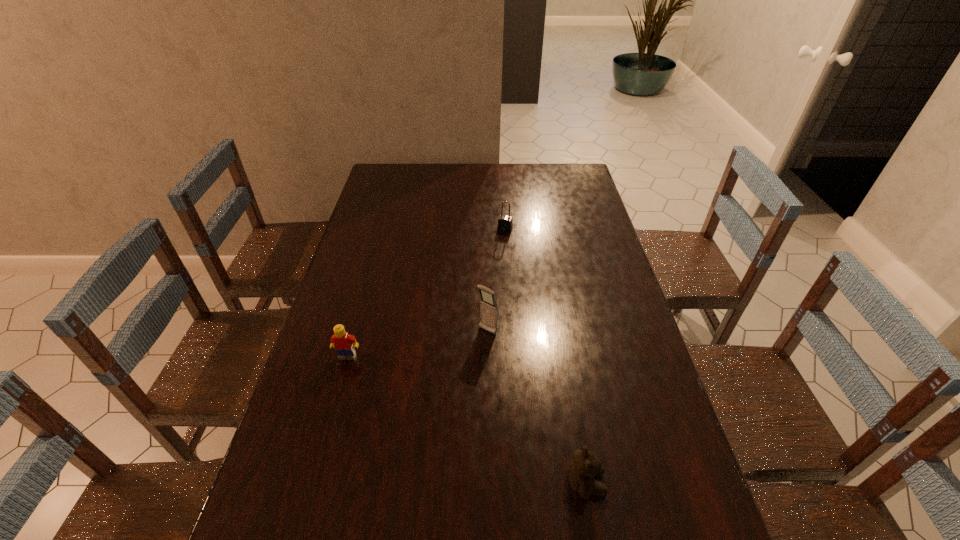
Where is `free space between the second nearest object and the farthest object`? Image resolution: width=960 pixels, height=540 pixels. free space between the second nearest object and the farthest object is located at coordinates (426, 292).

This screenshot has height=540, width=960. I want to click on free spot between the padlock and the Lego, so click(x=426, y=292).

Find the location of `empty space that is in between the cellular telephone and the second object from right to left`. empty space that is in between the cellular telephone and the second object from right to left is located at coordinates (496, 280).

Where is `free space between the second object from left to right and the farthest object`? The width and height of the screenshot is (960, 540). free space between the second object from left to right and the farthest object is located at coordinates (496, 280).

Identify the location of the closest object to the second nearest object. This screenshot has width=960, height=540. (489, 310).

Where is `object that ranks as the third closest to the second nearest object`? object that ranks as the third closest to the second nearest object is located at coordinates (505, 223).

Identify the location of vacant position in the image that satisfies the following two spatial constraints: 1. on the front side of the third nearest object; 2. on the face of the teddy bear. (490, 483).

Find the location of `vacant region that satisfies the following two spatial constraints: 1. on the front side of the rightmost object; 2. on the face of the padlock`. vacant region that satisfies the following two spatial constraints: 1. on the front side of the rightmost object; 2. on the face of the padlock is located at coordinates (523, 483).

This screenshot has height=540, width=960. What are the coordinates of `free location that satisfies the following two spatial constraints: 1. on the front-facing side of the Lego; 2. on the face of the teddy bear` in the screenshot? It's located at (312, 483).

The width and height of the screenshot is (960, 540). I want to click on vacant position in the image that satisfies the following two spatial constraints: 1. on the front-facing side of the nearest object; 2. on the face of the leftmost object, so click(312, 483).